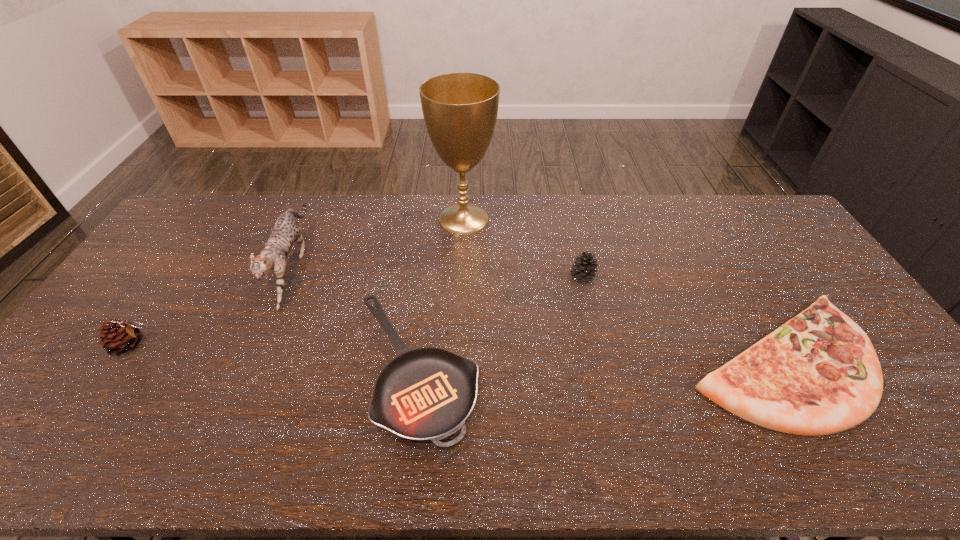
You are a GUI agent. You are given a task and a screenshot of the screen. Output one action in this format:
    pyautogui.click(x=<x>, y=<y>)
    Task: Click on the blank space located on the left of the tallest object
    This screenshot has height=540, width=960.
    Given the screenshot: What is the action you would take?
    pyautogui.click(x=354, y=218)

Find the location of `free space located 0.400m on the face of the second tallest object`. free space located 0.400m on the face of the second tallest object is located at coordinates (212, 451).

This screenshot has width=960, height=540. Identify the location of vacant space located 0.170m on the right of the second object from right to left. (649, 278).

Locate an element on the screen. The height and width of the screenshot is (540, 960). free point located with a leaf charm attached to the nearer pinecone is located at coordinates (214, 345).

Find the location of `free location located 0.110m on the left of the pizza`. free location located 0.110m on the left of the pizza is located at coordinates (642, 361).

Locate an element on the screen. This screenshot has width=960, height=540. vacant space located 0.380m on the left of the shortest object is located at coordinates (205, 369).

The height and width of the screenshot is (540, 960). In order to click on trophy cup at the far edge in this screenshot , I will do `click(460, 110)`.

The image size is (960, 540). What are the coordinates of `cat that is positioned at the far edge` in the screenshot? It's located at (286, 231).

Identify the location of pizza situated at the near edge. This screenshot has height=540, width=960. (818, 374).

At what (x,y) coordinates should I click in order to perform the action: click on frying pan that is at the near edge. Please return your answer as a coordinate pair (x, y). The width and height of the screenshot is (960, 540). Looking at the image, I should click on (425, 394).